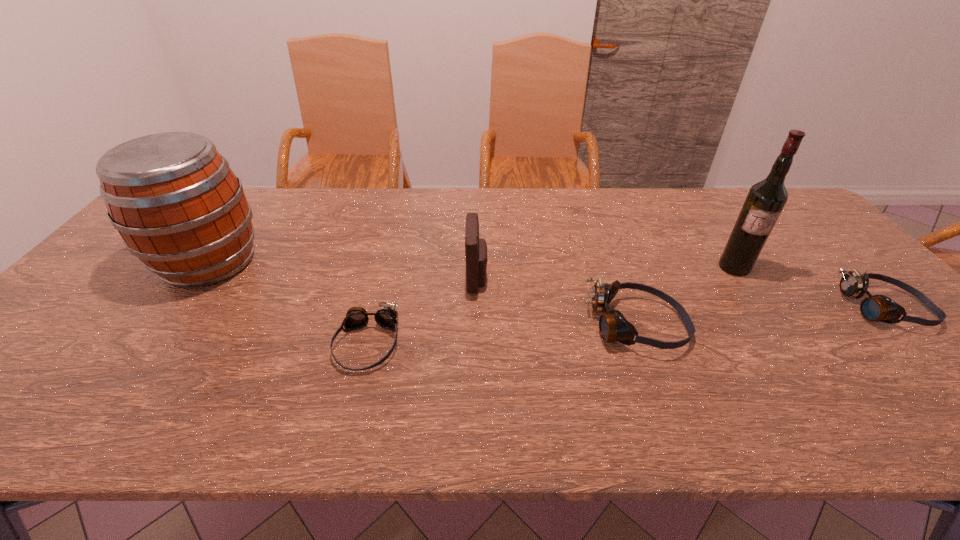
Please point a free position for a goggles on the left. Please provide its 2D coordinates. Your answer should be formatted as a tuple, i.e. [(x, y)], where the tuple contains the x and y coordinates of a point satisfying the conditions above.

[(73, 364)]